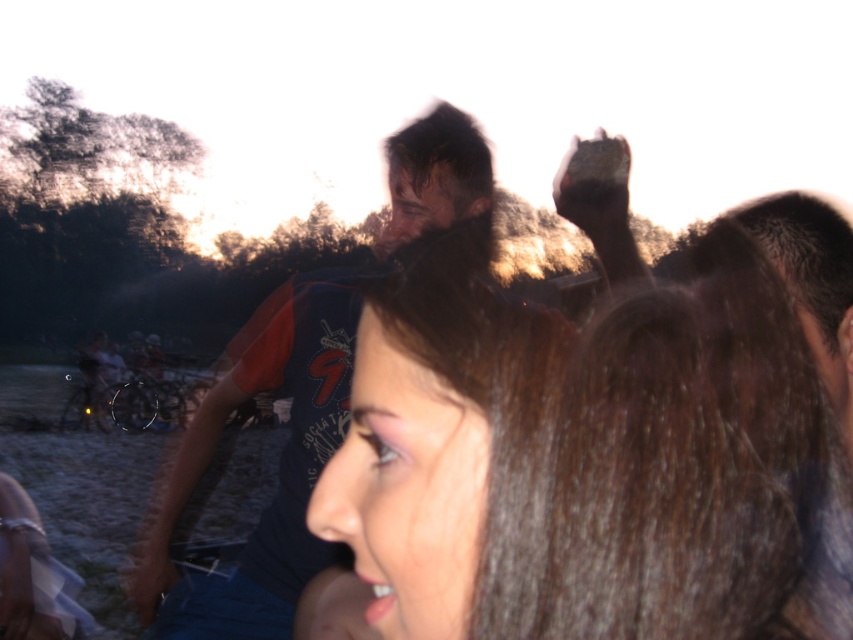
Question: Where is brown hair at center located in relation to dark blue t-shirt at upper center in the image?

Choices:
 (A) left
 (B) right

Answer: (B)

Question: Which of the following is the closest to the observer?

Choices:
 (A) (453, 422)
 (B) (283, 528)

Answer: (A)

Question: Is brown hair at center below dark blue t-shirt at upper center?

Choices:
 (A) yes
 (B) no

Answer: (B)

Question: Does brown hair at center have a greater width compared to dark blue t-shirt at upper center?

Choices:
 (A) no
 (B) yes

Answer: (A)